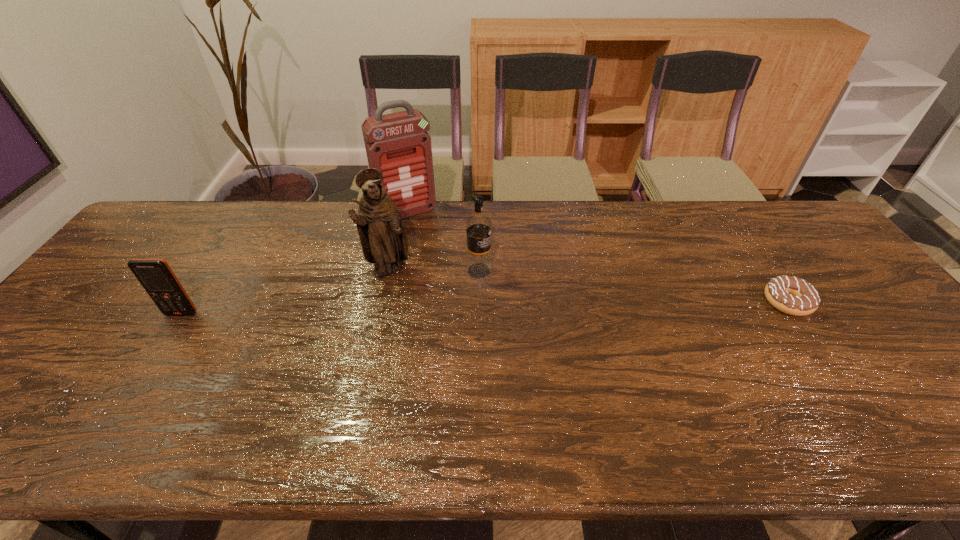
Where is `the leftmost object`? The width and height of the screenshot is (960, 540). the leftmost object is located at coordinates (155, 275).

The height and width of the screenshot is (540, 960). I want to click on the second shortest object, so click(x=155, y=275).

This screenshot has height=540, width=960. Find the location of `the shortest object`. the shortest object is located at coordinates (789, 294).

You are a GUI agent. You are given a task and a screenshot of the screen. Output one action in this format:
    pyautogui.click(x=<x>, y=<y>)
    Task: Click on the rightmost object
    
    Given the screenshot: What is the action you would take?
    pyautogui.click(x=789, y=294)

Find the location of `the fourth shortest object`. the fourth shortest object is located at coordinates (383, 239).

What are the coordinates of `the second object from right to left` in the screenshot? It's located at (478, 225).

Locate an element on the screen. This screenshot has height=540, width=960. the third tallest object is located at coordinates (478, 225).

Locate an element on the screen. the farthest object is located at coordinates (397, 144).

Find the location of a particular element. The width and height of the screenshot is (960, 540). the tallest object is located at coordinates (397, 144).

The width and height of the screenshot is (960, 540). I want to click on free space located on the screen of the leftmost object, so click(x=142, y=376).